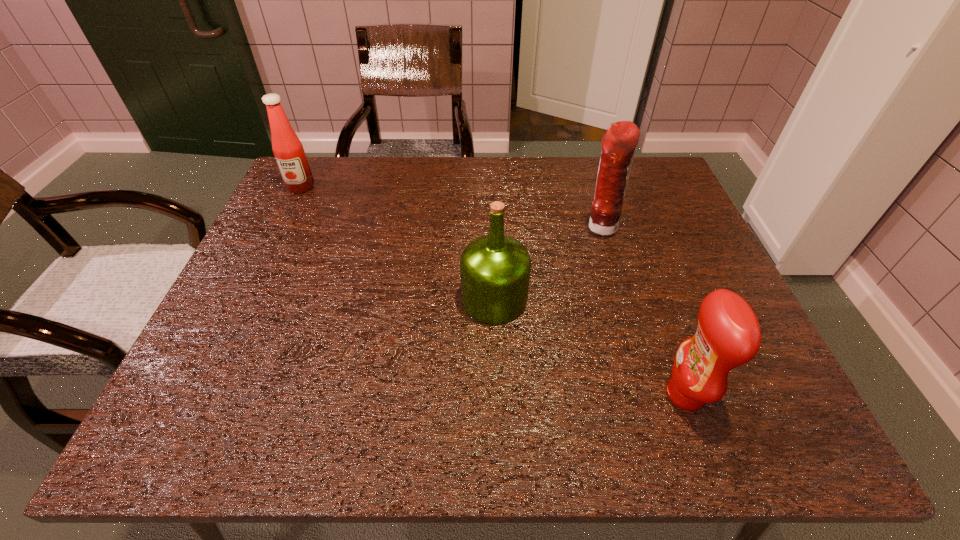
The height and width of the screenshot is (540, 960). What are the coordinates of `vacant point located between the nearest condiment and the third object from right to left` in the screenshot? It's located at (589, 347).

Where is `free area in between the farthest object and the second farthest object`? This screenshot has width=960, height=540. free area in between the farthest object and the second farthest object is located at coordinates (450, 207).

The height and width of the screenshot is (540, 960). What are the coordinates of `free spot between the third object from right to left and the nearest object` in the screenshot? It's located at (589, 347).

Select which object appears as the closest to the second nearest object. Please provide its 2D coordinates. Your answer should be formatted as a tuple, i.e. [(x, y)], where the tuple contains the x and y coordinates of a point satisfying the conditions above.

[(619, 142)]

This screenshot has height=540, width=960. In order to click on object that is the second closest to the second farthest condiment in this screenshot , I will do `click(728, 335)`.

Locate which condiment is the second closest to the olive oil. Please provide its 2D coordinates. Your answer should be formatted as a tuple, i.e. [(x, y)], where the tuple contains the x and y coordinates of a point satisfying the conditions above.

[(728, 335)]

The height and width of the screenshot is (540, 960). Identify the location of condiment identified as the second closest to the leftmost condiment. (728, 335).

Locate an element on the screen. Image resolution: width=960 pixels, height=540 pixels. vacant space that satisfies the following two spatial constraints: 1. on the front-facing side of the third farthest object; 2. on the right side of the farthest object is located at coordinates (246, 299).

The height and width of the screenshot is (540, 960). Find the location of `vacant area in the image that satisfies the following two spatial constraints: 1. on the front-facing side of the farthest condiment; 2. on the right side of the third nearest object`. vacant area in the image that satisfies the following two spatial constraints: 1. on the front-facing side of the farthest condiment; 2. on the right side of the third nearest object is located at coordinates (281, 227).

This screenshot has height=540, width=960. I want to click on blank space that satisfies the following two spatial constraints: 1. on the front-facing side of the second nearest object; 2. on the left side of the farthest condiment, so click(246, 299).